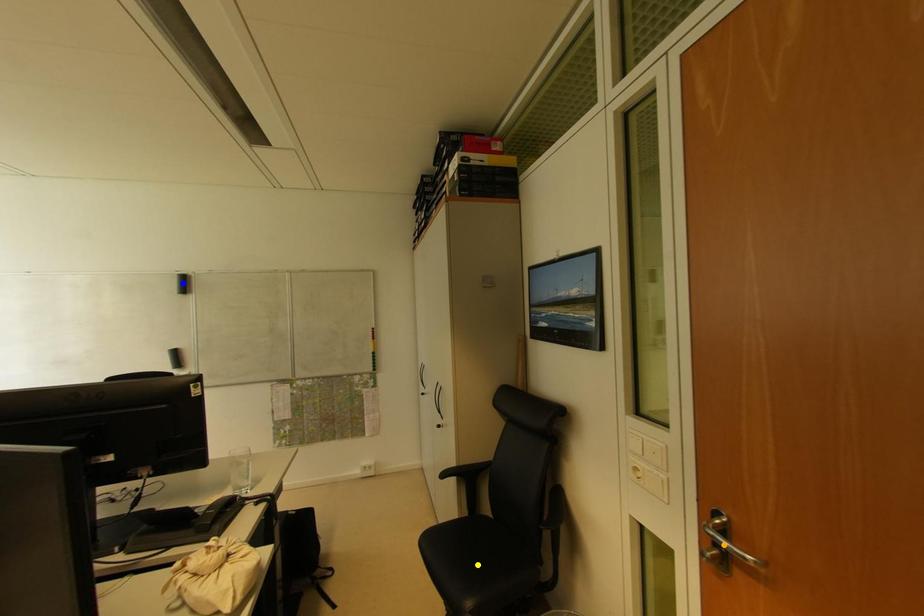
Order these from nearest to farthest:
1. blue point
2. orange point
3. yellow point

orange point < yellow point < blue point